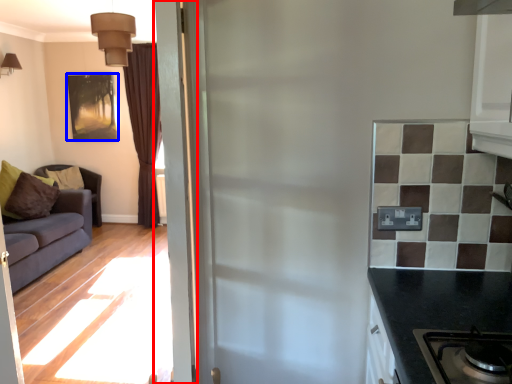
Question: Which point is further to the camera, door (highlighted by a red box) or picture frame (highlighted by a blue box)?

Choices:
 (A) door
 (B) picture frame

Answer: (B)